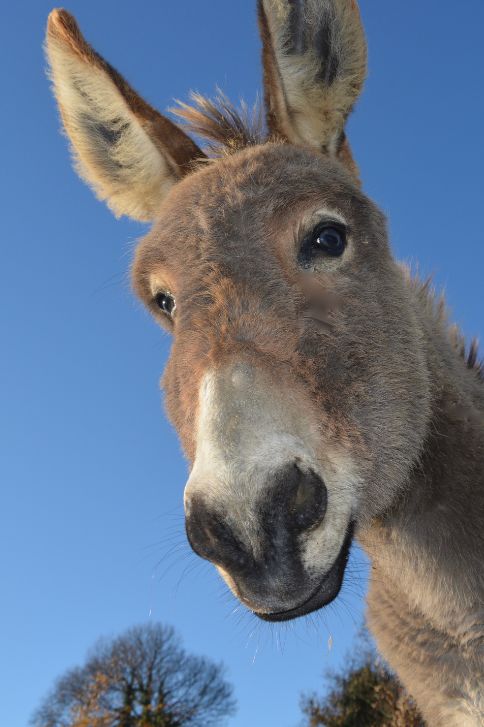
You are a GUI agent. You are given a task and a screenshot of the screen. Output one action in this format:
    pyautogui.click(x=<x>, y=<y>)
    Task: Click on the white fur
    
    Given the screenshot: What is the action you would take?
    pyautogui.click(x=215, y=446), pyautogui.click(x=266, y=419), pyautogui.click(x=332, y=531)